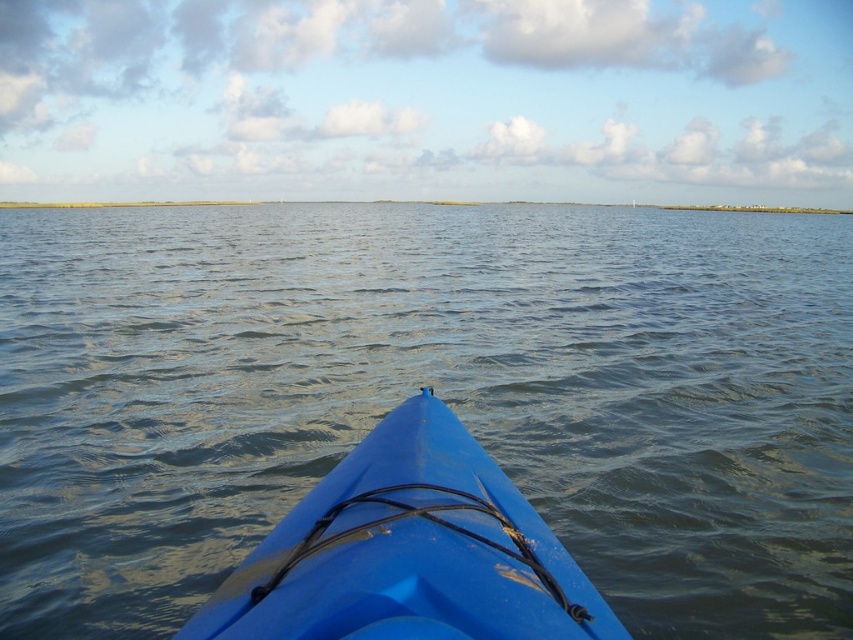
Question: Is blue water at center above blue plastic kayak at center?

Choices:
 (A) yes
 (B) no

Answer: (A)

Question: Which point appears farthest from the camera in this image?

Choices:
 (A) (734, 448)
 (B) (381, 570)

Answer: (A)

Question: Which object is farther from the camera taking this photo?

Choices:
 (A) blue water at center
 (B) blue plastic kayak at center

Answer: (A)

Question: Among these points, which one is farthest from the camera?

Choices:
 (A) (395, 497)
 (B) (55, 611)

Answer: (B)

Question: Does blue water at center have a larger size compared to blue plastic kayak at center?

Choices:
 (A) no
 (B) yes

Answer: (B)

Question: Can you confirm if blue water at center is bigger than blue plastic kayak at center?

Choices:
 (A) no
 (B) yes

Answer: (B)